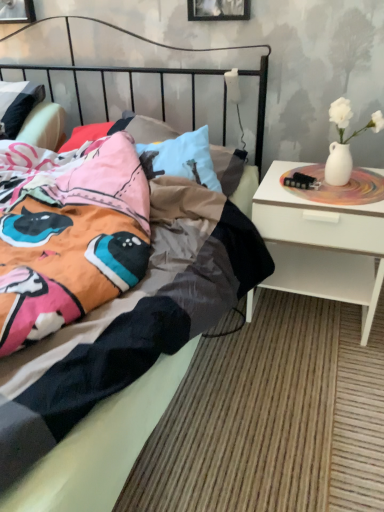
You are a GUI agent. You are given a task and a screenshot of the screen. Output one action in this format:
    pyautogui.click(x=<x>, y=<y>)
    Task: Click on the metallic silver picture frame at upper left, placed as the second picture frame when sorted from front to back
    The height and width of the screenshot is (512, 384).
    Given the screenshot: What is the action you would take?
    pyautogui.click(x=17, y=11)

Locate an element on the screen. white glossy nightstand at right is located at coordinates (321, 245).

Which is behind, white glossy nightstand at right or black matte picture frame at upper center, positioned as the first picture frame in right-to-left order?

black matte picture frame at upper center, positioned as the first picture frame in right-to-left order, is further away from the camera.

In terms of size, does white glossy nightstand at right appear bigger or smaller than black matte picture frame at upper center, the second picture frame from the left?

In the image, white glossy nightstand at right appears to be larger than black matte picture frame at upper center, the second picture frame from the left.

Considering the relative sizes of white glossy nightstand at right and black matte picture frame at upper center, which ranks as the 1th picture frame in front-to-back order, in the image provided, is white glossy nightstand at right shorter than black matte picture frame at upper center, which ranks as the 1th picture frame in front-to-back order,?

No.

Where is `nightstand below the black matte picture frame at upper center, arranged as the second picture frame when viewed from the back (from a real-world perspective)`? This screenshot has width=384, height=512. nightstand below the black matte picture frame at upper center, arranged as the second picture frame when viewed from the back (from a real-world perspective) is located at coordinates (321, 245).

From the image's perspective, is metallic silver picture frame at upper left, arranged as the 2th picture frame when viewed from the right, under white glossy nightstand at right?

No, from the image's perspective, metallic silver picture frame at upper left, arranged as the 2th picture frame when viewed from the right, is not below white glossy nightstand at right.

Which of these two, metallic silver picture frame at upper left, arranged as the 2th picture frame when viewed from the right, or white glossy nightstand at right, is smaller?

Smaller between the two is metallic silver picture frame at upper left, arranged as the 2th picture frame when viewed from the right.

Considering the positions of objects metallic silver picture frame at upper left, the 1th picture frame in the back-to-front sequence, and white glossy nightstand at right in the image provided, who is behind, metallic silver picture frame at upper left, the 1th picture frame in the back-to-front sequence, or white glossy nightstand at right?

metallic silver picture frame at upper left, the 1th picture frame in the back-to-front sequence, is further from the camera.

Between white glossy nightstand at right and metallic silver picture frame at upper left, the 1th picture frame in the back-to-front sequence, which one has larger width?

With larger width is white glossy nightstand at right.

Is white glossy nightstand at right next to metallic silver picture frame at upper left, arranged as the 2th picture frame when viewed from the right, and touching it?

No, white glossy nightstand at right is not in contact with metallic silver picture frame at upper left, arranged as the 2th picture frame when viewed from the right.

Is white glossy nightstand at right turned away from metallic silver picture frame at upper left, placed as the second picture frame when sorted from front to back?

white glossy nightstand at right does not have its back to metallic silver picture frame at upper left, placed as the second picture frame when sorted from front to back.

From a real-world perspective, which is physically below, white glossy nightstand at right or metallic silver picture frame at upper left, the 1th picture frame in the back-to-front sequence?

white glossy nightstand at right.

Is metallic silver picture frame at upper left, placed as the second picture frame when sorted from front to back, in front of or behind black matte picture frame at upper center, the second picture frame from the left, in the image?

metallic silver picture frame at upper left, placed as the second picture frame when sorted from front to back, is behind black matte picture frame at upper center, the second picture frame from the left.

From a real-world perspective, is metallic silver picture frame at upper left, the 1th picture frame in the back-to-front sequence, located higher than black matte picture frame at upper center, positioned as the first picture frame in right-to-left order?

No, from a real-world perspective, metallic silver picture frame at upper left, the 1th picture frame in the back-to-front sequence, is not above black matte picture frame at upper center, positioned as the first picture frame in right-to-left order.

Considering the positions of objects metallic silver picture frame at upper left, the 1th picture frame in the back-to-front sequence, and black matte picture frame at upper center, the second picture frame from the left, in the image provided, who is more to the left, metallic silver picture frame at upper left, the 1th picture frame in the back-to-front sequence, or black matte picture frame at upper center, the second picture frame from the left,?

metallic silver picture frame at upper left, the 1th picture frame in the back-to-front sequence.

Between metallic silver picture frame at upper left, placed as the second picture frame when sorted from front to back, and black matte picture frame at upper center, the second picture frame from the left, which one has smaller size?

black matte picture frame at upper center, the second picture frame from the left, is smaller.

Consider the image. From the image's perspective, between black matte picture frame at upper center, arranged as the second picture frame when viewed from the back, and metallic silver picture frame at upper left, arranged as the 2th picture frame when viewed from the right, which one is located above?

metallic silver picture frame at upper left, arranged as the 2th picture frame when viewed from the right, appears higher in the image.

Is point (233, 4) closer or farther from the camera than point (34, 19)?

Point (233, 4) is closer to the camera than point (34, 19).

Is black matte picture frame at upper center, the second picture frame from the left, situated inside metallic silver picture frame at upper left, arranged as the first picture frame when viewed from the left, or outside?

black matte picture frame at upper center, the second picture frame from the left, is outside metallic silver picture frame at upper left, arranged as the first picture frame when viewed from the left.

Consider the image. Is black matte picture frame at upper center, positioned as the first picture frame in right-to-left order, in front of metallic silver picture frame at upper left, the 1th picture frame in the back-to-front sequence?

Yes, black matte picture frame at upper center, positioned as the first picture frame in right-to-left order, is in front of metallic silver picture frame at upper left, the 1th picture frame in the back-to-front sequence.

How different are the orientations of black matte picture frame at upper center, which ranks as the 1th picture frame in front-to-back order, and white glossy nightstand at right in degrees?

0.854 degrees.

Are black matte picture frame at upper center, the second picture frame from the left, and white glossy nightstand at right far apart?

That's not correct — black matte picture frame at upper center, the second picture frame from the left, is a little close to white glossy nightstand at right.

Does black matte picture frame at upper center, the second picture frame from the left, turn towards white glossy nightstand at right?

No, black matte picture frame at upper center, the second picture frame from the left, is not facing towards white glossy nightstand at right.

Does black matte picture frame at upper center, arranged as the second picture frame when viewed from the back, appear on the right side of white glossy nightstand at right?

Incorrect, black matte picture frame at upper center, arranged as the second picture frame when viewed from the back, is not on the right side of white glossy nightstand at right.

Identify the location of nightstand that is on the right side of black matte picture frame at upper center, the second picture frame from the left. 321,245.

Starting from the white glossy nightstand at right, which picture frame is the 2nd one behind? Please provide its 2D coordinates.

[(17, 11)]

From the image, which object appears to be farther from metallic silver picture frame at upper left, arranged as the first picture frame when viewed from the left, white glossy nightstand at right or black matte picture frame at upper center, arranged as the second picture frame when viewed from the back?

Among the two, white glossy nightstand at right is located further to metallic silver picture frame at upper left, arranged as the first picture frame when viewed from the left.

From the image, which object appears to be farther from white glossy nightstand at right, metallic silver picture frame at upper left, arranged as the first picture frame when viewed from the left, or black matte picture frame at upper center, which ranks as the 1th picture frame in front-to-back order?

Based on the image, metallic silver picture frame at upper left, arranged as the first picture frame when viewed from the left, appears to be further to white glossy nightstand at right.

Looking at the image, which one is located closer to metallic silver picture frame at upper left, placed as the second picture frame when sorted from front to back, black matte picture frame at upper center, which ranks as the 1th picture frame in front-to-back order, or white glossy nightstand at right?

black matte picture frame at upper center, which ranks as the 1th picture frame in front-to-back order, is positioned closer to the anchor metallic silver picture frame at upper left, placed as the second picture frame when sorted from front to back.

Considering their positions, is black matte picture frame at upper center, the second picture frame from the left, positioned closer to white glossy nightstand at right than metallic silver picture frame at upper left, arranged as the 2th picture frame when viewed from the right?

black matte picture frame at upper center, the second picture frame from the left, is closer to white glossy nightstand at right.

Estimate the real-world distances between objects in this image. Which object is further from black matte picture frame at upper center, positioned as the first picture frame in right-to-left order, white glossy nightstand at right or metallic silver picture frame at upper left, placed as the second picture frame when sorted from front to back?

Among the two, white glossy nightstand at right is located further to black matte picture frame at upper center, positioned as the first picture frame in right-to-left order.

Based on the photo, when comparing their distances from black matte picture frame at upper center, the second picture frame from the left, does metallic silver picture frame at upper left, arranged as the first picture frame when viewed from the left, or white glossy nightstand at right seem further?

white glossy nightstand at right lies further to black matte picture frame at upper center, the second picture frame from the left, than the other object.

Find the location of a particular element. Image resolution: width=384 pixels, height=512 pixels. picture frame between metallic silver picture frame at upper left, arranged as the first picture frame when viewed from the left, and white glossy nightstand at right from left to right is located at coordinates (218, 10).